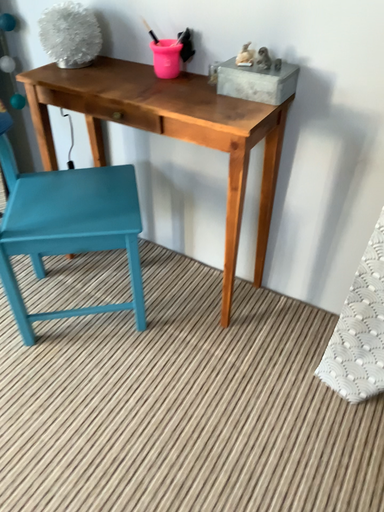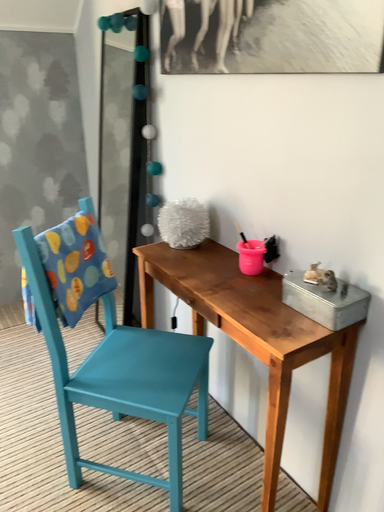
Question: How did the camera likely rotate when shooting the video?

Choices:
 (A) rotated left
 (B) rotated right

Answer: (A)